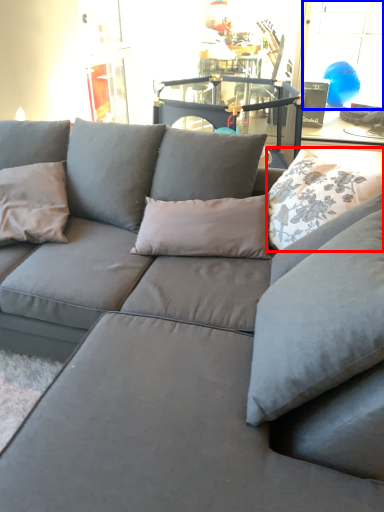
Question: Which of the following is the closest to the observer, pillow (highlighted by a red box) or window (highlighted by a blue box)?

Choices:
 (A) pillow
 (B) window

Answer: (A)